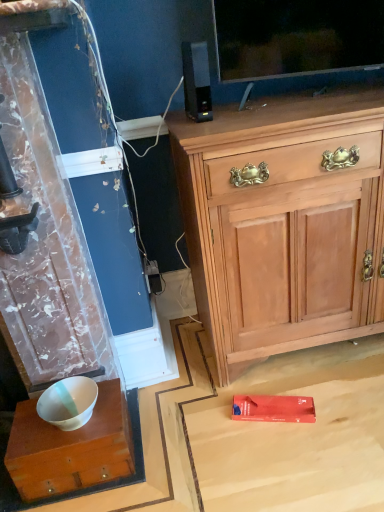
The height and width of the screenshot is (512, 384). What are the coordinates of `free space in front of light wood cabinet at upper right` in the screenshot? It's located at (305, 425).